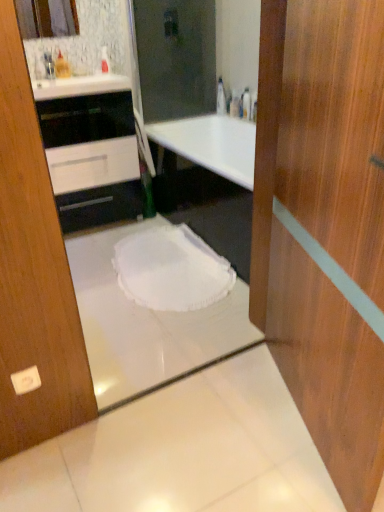
The height and width of the screenshot is (512, 384). What are the coordinates of `vacant space situated above white fabric toilet at center (from a real-world perspective)` in the screenshot? It's located at 168,258.